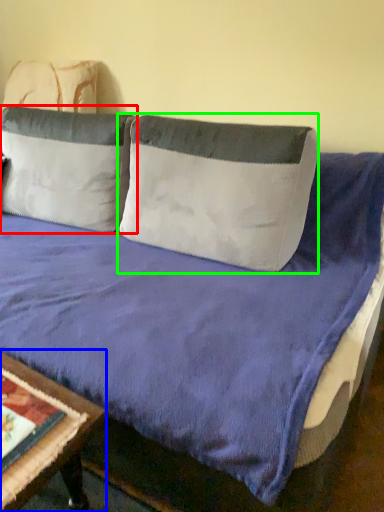
Question: Which object is the closest to the pillow (highlighted by a red box)? Choose among these: table (highlighted by a blue box) or pillow (highlighted by a green box).

Choices:
 (A) table
 (B) pillow

Answer: (B)